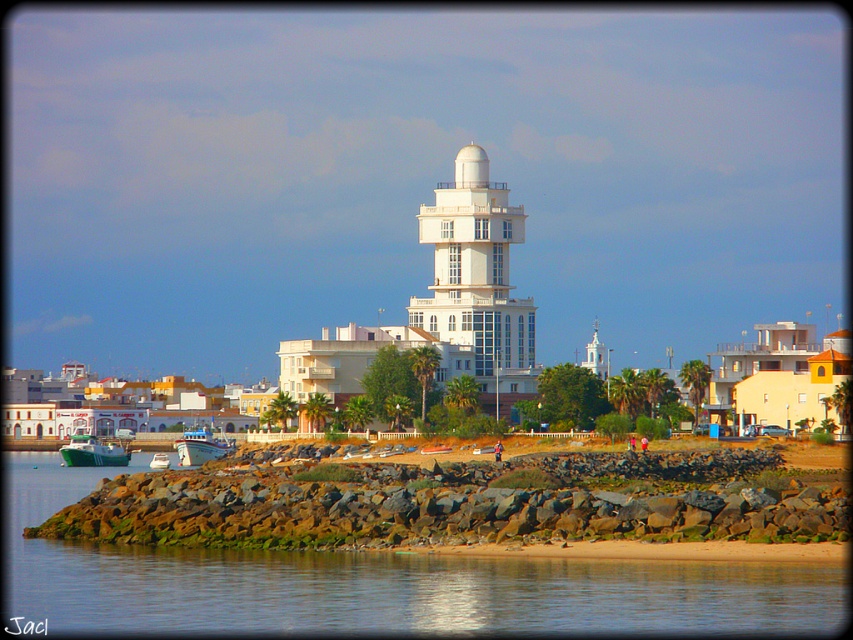
Does white glossy tower at center lie in front of green matte boat at lower left?

No, it is not.

Does white glossy tower at center have a lesser width compared to green matte boat at lower left?

Yes.

Is point (422, 236) positioned after point (80, 445)?

Yes, it is behind point (80, 445).

The height and width of the screenshot is (640, 853). In order to click on white glossy tower at center in this screenshot , I will do coord(477,280).

Can you confirm if white glossy tower at center is shorter than white glossy boat at center?

No, white glossy tower at center is not shorter than white glossy boat at center.

Can you confirm if white glossy tower at center is bigger than white glossy boat at center?

Yes.

Who is more forward, [503,337] or [213,442]?

Positioned in front is point [213,442].

Where is `white glossy tower at center`? white glossy tower at center is located at coordinates (477, 280).

Can you confirm if green stone wall at lower center is smaller than white glossy boat at center?

No.

Which is below, green stone wall at lower center or white glossy boat at center?

Positioned lower is green stone wall at lower center.

Locate an element on the screen. The image size is (853, 640). green stone wall at lower center is located at coordinates [381, 584].